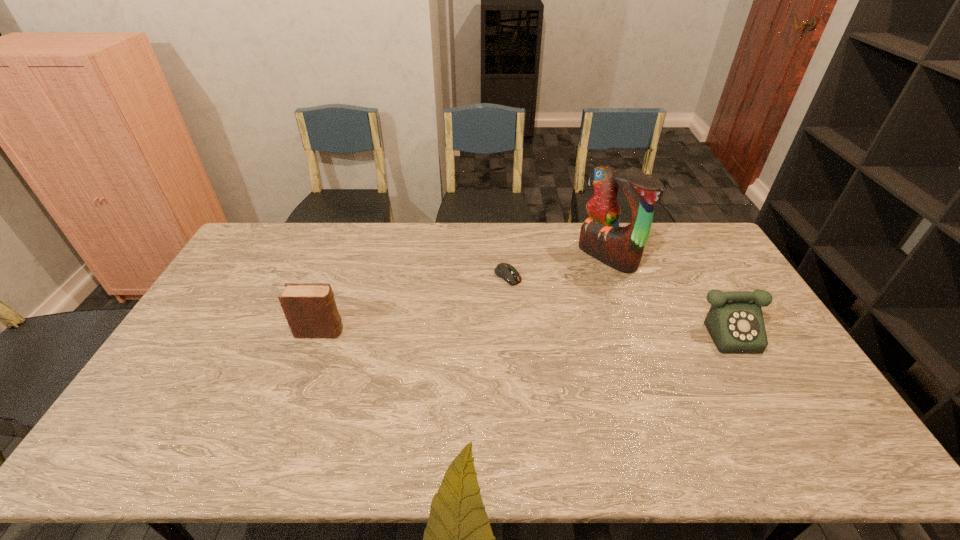
The height and width of the screenshot is (540, 960). What are the coordinates of `vacant space at the right edge of the desktop` in the screenshot? It's located at (779, 382).

Find the location of a particular element. free location at the far left corner is located at coordinates (266, 235).

You are a GUI agent. You are given a task and a screenshot of the screen. Output one action in this format:
    pyautogui.click(x=<x>, y=<y>)
    Task: Click on the vacant area that lies between the leftmost object and the computer equipment
    
    Given the screenshot: What is the action you would take?
    pyautogui.click(x=414, y=304)

Where is `vacant area that lies between the computer equipment and the second object from right to left`? The height and width of the screenshot is (540, 960). vacant area that lies between the computer equipment and the second object from right to left is located at coordinates (x=558, y=266).

Locate an element on the screen. The width and height of the screenshot is (960, 540). free spot between the telephone and the second object from right to left is located at coordinates (675, 293).

Where is `vacant space in between the diary and the rightmost object`? This screenshot has height=540, width=960. vacant space in between the diary and the rightmost object is located at coordinates (532, 331).

The image size is (960, 540). What are the coordinates of `unoccupied position between the second object from left to right and the leftmost object` in the screenshot? It's located at (414, 304).

Where is `free space between the third shortest object and the second object from left to right`? free space between the third shortest object and the second object from left to right is located at coordinates (414, 304).

Identify the location of empty location between the telephone and the tallest object. (675, 293).

Locate an element on the screen. This screenshot has height=540, width=960. vacant space that is in between the telephone and the tallest object is located at coordinates (675, 293).